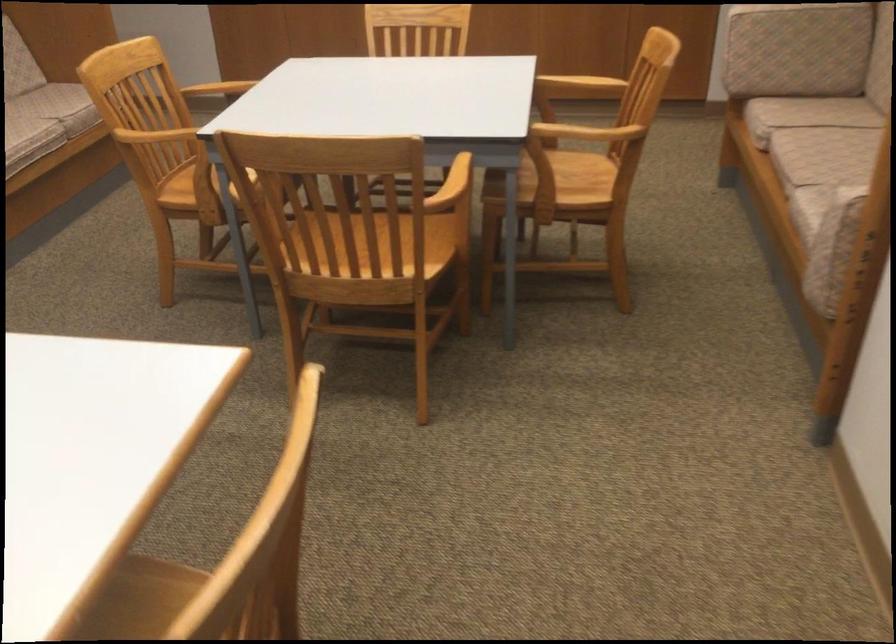
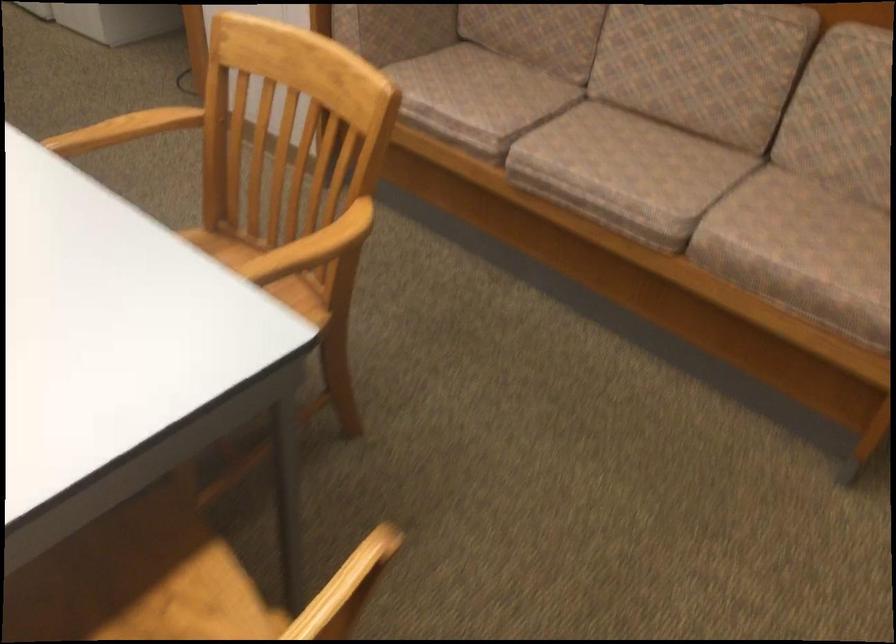
Question: I am providing you with two images of the same scene from different viewpoints. After the viewpoint changes to image2, which objects are now occluded?

Choices:
 (A) chair sitting surface
 (B) capsule holder lid
 (C) sofa sitting surface
 (D) wooden chair armrest

Answer: (A)